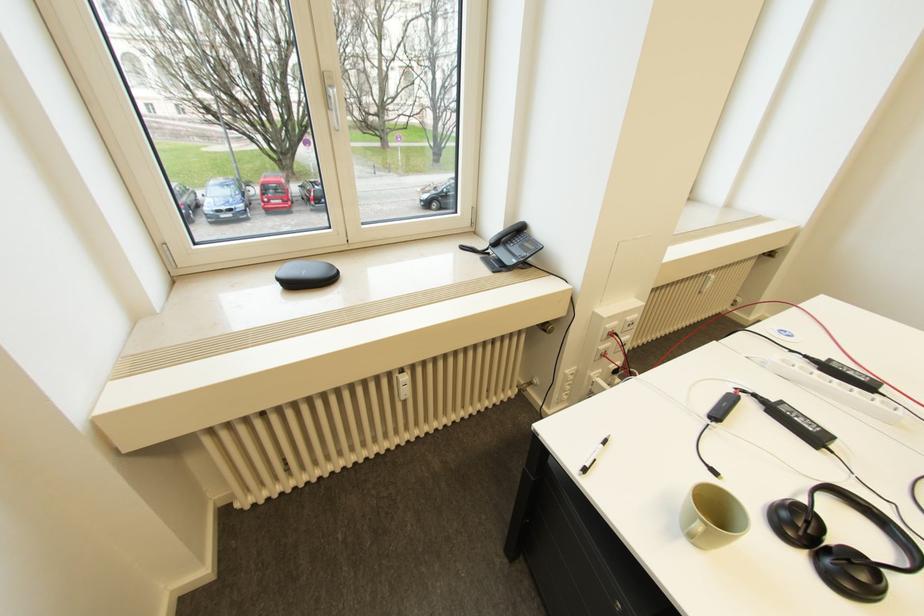
The image size is (924, 616). What do you see at coordinates (332, 100) in the screenshot?
I see `a white window handle` at bounding box center [332, 100].